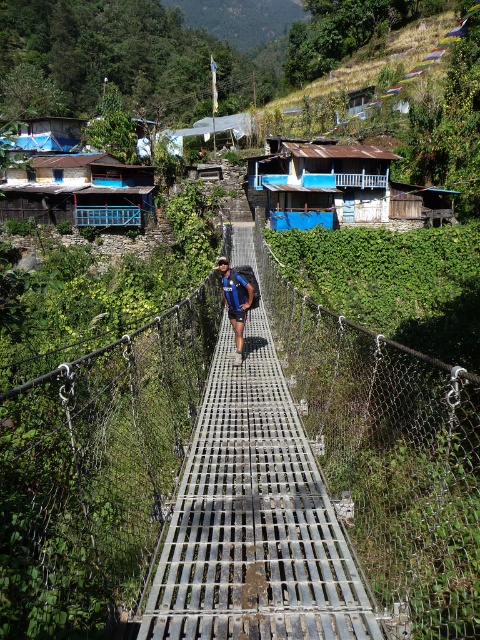
Question: Which point is closer to the camera?

Choices:
 (A) blue fabric backpack at center
 (B) rusty metal hut at center

Answer: (A)

Question: Does metal grating bridge at center have a smaller size compared to blue fabric backpack at center?

Choices:
 (A) yes
 (B) no

Answer: (B)

Question: Considering the real-world distances, which object is farthest from the metal grating bridge at center?

Choices:
 (A) rusty metal hut at center
 (B) blue fabric backpack at center

Answer: (A)

Question: Is metal grating bridge at center smaller than rusty metal hut at center?

Choices:
 (A) yes
 (B) no

Answer: (A)

Question: Which is nearer to the rusty metal hut at center?

Choices:
 (A) metal grating bridge at center
 (B) blue fabric backpack at center

Answer: (A)

Question: Is rusty metal hut at center positioned in front of blue fabric backpack at center?

Choices:
 (A) no
 (B) yes

Answer: (A)